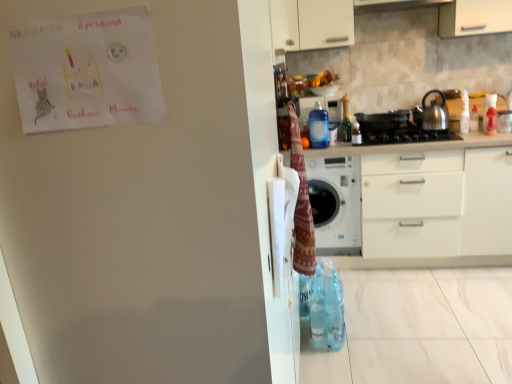
Where is `translucent plastic bottle at upper right, which is the 2th bottle from left to right`? This screenshot has width=512, height=384. translucent plastic bottle at upper right, which is the 2th bottle from left to right is located at coordinates (346, 120).

This screenshot has height=384, width=512. Describe the element at coordinates (406, 136) in the screenshot. I see `satin black gas stove at center` at that location.

Measure the distance between point (465,122) and camera.

The depth of point (465,122) is 2.72 meters.

What do you see at coordinates (474, 119) in the screenshot? The height and width of the screenshot is (384, 512). I see `translucent plastic bottle at upper right, marked as the fourth bottle in a left-to-right arrangement` at bounding box center [474, 119].

Identify the location of satin silver kettle at right. The width and height of the screenshot is (512, 384). (432, 113).

Describe the element at coordinates (301, 203) in the screenshot. I see `knitted woolen blanket at upper right` at that location.

This screenshot has width=512, height=384. Identify the location of white glossy washing machine at center. (335, 203).

In the scene shown: How many degrees apart are the facing directions of transparent plastic spray bottle at upper right, which is the 3th bottle from left to right, and metallic black stove at center?

The angular difference between transparent plastic spray bottle at upper right, which is the 3th bottle from left to right, and metallic black stove at center is 3.13 degrees.

From the image's perspective, is transparent plastic spray bottle at upper right, the second bottle from the right, beneath metallic black stove at center?

Actually, transparent plastic spray bottle at upper right, the second bottle from the right, appears above metallic black stove at center in the image.

Is point (465, 112) positioned behind point (387, 122)?

That is False.

Based on the photo, does transparent plastic spray bottle at upper right, which is the 3th bottle from left to right, have a larger size compared to metallic black stove at center?

No, transparent plastic spray bottle at upper right, which is the 3th bottle from left to right, is not bigger than metallic black stove at center.

Considering the sizes of objects knitted woolen blanket at upper right and satin black gas stove at center in the image provided, who is shorter, knitted woolen blanket at upper right or satin black gas stove at center?

satin black gas stove at center is shorter.

Is knitted woolen blanket at upper right thinner than satin black gas stove at center?

Yes, knitted woolen blanket at upper right is thinner than satin black gas stove at center.

Is knitted woolen blanket at upper right further to the viewer compared to satin black gas stove at center?

No, knitted woolen blanket at upper right is closer to the camera.

Does white glossy washing machine at center have a lesser width compared to translucent plastic bottle at upper right, placed as the 1th bottle when sorted from right to left?

In fact, white glossy washing machine at center might be wider than translucent plastic bottle at upper right, placed as the 1th bottle when sorted from right to left.

Locate an element on the screen. This screenshot has width=512, height=384. the 1st bottle positioned above the white glossy washing machine at center (from a real-world perspective) is located at coordinates (474, 119).

Is white glossy washing machine at center bigger or smaller than translucent plastic bottle at upper right, marked as the fourth bottle in a left-to-right arrangement?

white glossy washing machine at center is bigger than translucent plastic bottle at upper right, marked as the fourth bottle in a left-to-right arrangement.

Considering the relative sizes of white glossy washing machine at center and satin black gas stove at center in the image provided, is white glossy washing machine at center smaller than satin black gas stove at center?

Actually, white glossy washing machine at center might be larger than satin black gas stove at center.

What are the coordinates of `gas stove above the white glossy washing machine at center (from a real-world perspective)` in the screenshot? It's located at (406, 136).

From the image's perspective, between white glossy washing machine at center and satin black gas stove at center, who is located below?

white glossy washing machine at center is shown below in the image.

Is white glossy washing machine at center oriented towards satin black gas stove at center?

No, white glossy washing machine at center is not turned towards satin black gas stove at center.

Which object is wider, transparent plastic spray bottle at upper right, the second bottle from the right, or translucent plastic bottle at upper right, marked as the third bottle in a right-to-left arrangement?

transparent plastic spray bottle at upper right, the second bottle from the right, is wider.

From a real-world perspective, between transparent plastic spray bottle at upper right, the second bottle from the right, and translucent plastic bottle at upper right, marked as the third bottle in a right-to-left arrangement, who is vertically lower?

transparent plastic spray bottle at upper right, the second bottle from the right, from a real-world perspective.

Is transparent plastic spray bottle at upper right, the second bottle from the right, positioned behind translucent plastic bottle at upper right, which is the 2th bottle from left to right?

That is False.

Locate an element on the screen. This screenshot has width=512, height=384. bottle that is the 2nd object located in front of the translucent plastic bottle at upper right, marked as the third bottle in a right-to-left arrangement is located at coordinates (464, 113).

In the scene shown: Between satin silver kettle at right and translucent plastic bottle at upper right, marked as the third bottle in a right-to-left arrangement, which one appears on the right side from the viewer's perspective?

satin silver kettle at right.

Is satin silver kettle at right not close to translucent plastic bottle at upper right, which is the 2th bottle from left to right?

Actually, satin silver kettle at right and translucent plastic bottle at upper right, which is the 2th bottle from left to right, are a little close together.

From the picture: From the image's perspective, is satin silver kettle at right positioned above or below translucent plastic bottle at upper right, which is the 2th bottle from left to right?

Clearly, from the image's perspective, satin silver kettle at right is above translucent plastic bottle at upper right, which is the 2th bottle from left to right.

Between point (416, 117) and point (342, 128), which one is positioned in front?

Point (416, 117)

Based on the photo, can you confirm if transparent plastic bottle at upper center, marked as the fourth bottle in a right-to-left arrangement, is smaller than transparent plastic spray bottle at upper right, which is the 3th bottle from left to right?

Incorrect, transparent plastic bottle at upper center, marked as the fourth bottle in a right-to-left arrangement, is not smaller in size than transparent plastic spray bottle at upper right, which is the 3th bottle from left to right.

Can you confirm if transparent plastic bottle at upper center, positioned as the first bottle in left-to-right order, is taller than transparent plastic spray bottle at upper right, which is the 3th bottle from left to right?

Correct, transparent plastic bottle at upper center, positioned as the first bottle in left-to-right order, is much taller as transparent plastic spray bottle at upper right, which is the 3th bottle from left to right.

From the image's perspective, is transparent plastic bottle at upper center, positioned as the first bottle in left-to-right order, on top of transparent plastic spray bottle at upper right, which is the 3th bottle from left to right?

No, from the image's perspective, transparent plastic bottle at upper center, positioned as the first bottle in left-to-right order, is not over transparent plastic spray bottle at upper right, which is the 3th bottle from left to right.

Does point (324, 116) appear closer or farther from the camera than point (463, 109)?

Clearly, point (324, 116) is closer to the camera than point (463, 109).

From a real-world perspective, which bottle is the 1st one above the metallic black stove at center? Please provide its 2D coordinates.

[(464, 113)]

In the image, there is a knitted woolen blanket at upper right. Identify the location of gas stove above it (from the image's perspective). The image size is (512, 384). (406, 136).

From the image, which object appears to be farther from transparent plastic spray bottle at upper right, the second bottle from the right, satin black gas stove at center or translucent plastic bottle at upper right, marked as the fourth bottle in a left-to-right arrangement?

The object further to transparent plastic spray bottle at upper right, the second bottle from the right, is satin black gas stove at center.

Based on their spatial positions, is white glossy washing machine at center or translucent plastic bottle at upper right, which is the 2th bottle from left to right, further from metallic black stove at center?

white glossy washing machine at center.

Considering their positions, is transparent plastic spray bottle at upper right, which is the 3th bottle from left to right, positioned closer to satin black gas stove at center than satin silver kettle at right?

satin silver kettle at right lies closer to satin black gas stove at center than the other object.

Looking at the image, which one is located closer to satin black gas stove at center, satin silver kettle at right or white glossy washing machine at center?

Based on the image, satin silver kettle at right appears to be nearer to satin black gas stove at center.

Which object lies nearer to the anchor point transparent plastic spray bottle at upper right, which is the 3th bottle from left to right, metallic black stove at center or transparent plastic bottle at upper center, marked as the fourth bottle in a right-to-left arrangement?

metallic black stove at center lies closer to transparent plastic spray bottle at upper right, which is the 3th bottle from left to right, than the other object.

From the image, which object appears to be farther from white glossy washing machine at center, translucent plastic bottle at upper right, marked as the third bottle in a right-to-left arrangement, or knitted woolen blanket at upper right?

knitted woolen blanket at upper right.

Looking at the image, which one is located further to knitted woolen blanket at upper right, white glossy washing machine at center or translucent plastic bottle at upper right, placed as the 1th bottle when sorted from right to left?

translucent plastic bottle at upper right, placed as the 1th bottle when sorted from right to left.

Consider the image. Which object lies further to the anchor point translucent plastic bottle at upper right, placed as the 1th bottle when sorted from right to left, satin black gas stove at center or transparent plastic bottle at upper center, marked as the fourth bottle in a right-to-left arrangement?

Among the two, transparent plastic bottle at upper center, marked as the fourth bottle in a right-to-left arrangement, is located further to translucent plastic bottle at upper right, placed as the 1th bottle when sorted from right to left.

The image size is (512, 384). Find the location of `kitchen appliance between knitted woolen blanket at upper right and translucent plastic bottle at upper right, which is the 2th bottle from left to right, in the front-back direction`. kitchen appliance between knitted woolen blanket at upper right and translucent plastic bottle at upper right, which is the 2th bottle from left to right, in the front-back direction is located at coordinates (432, 113).

Find the location of a particular element. This screenshot has height=384, width=512. bottle between metallic black stove at center and translucent plastic bottle at upper right, marked as the fourth bottle in a left-to-right arrangement, in the horizontal direction is located at coordinates (464, 113).

This screenshot has height=384, width=512. I want to click on appliance situated between white glossy washing machine at center and transparent plastic spray bottle at upper right, the second bottle from the right, from left to right, so click(x=382, y=121).

This screenshot has height=384, width=512. I want to click on bottle between transparent plastic bottle at upper center, marked as the fourth bottle in a right-to-left arrangement, and metallic black stove at center from left to right, so click(346, 120).